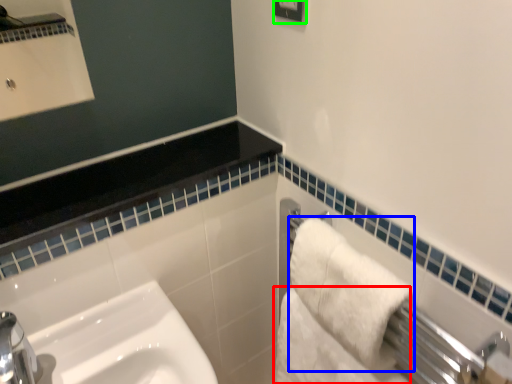
Question: Considering the real-world distances, which object is farthest from bath towel (highlighted by a red box)? bath towel (highlighted by a blue box) or square (highlighted by a green box)?

Choices:
 (A) bath towel
 (B) square

Answer: (B)